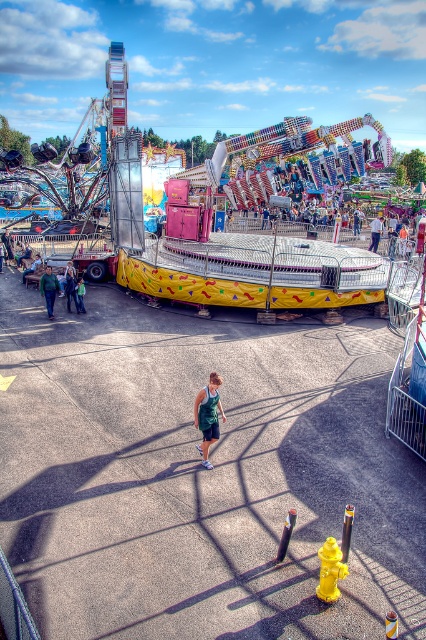
You are standing at the center of the fairground and want to find the green fabric jacket at lower left. According to the coordinates provided, in which direction should you move to locate it?

The green fabric jacket at lower left is located at coordinates point (48,289), so you should move towards the lower left direction to find it.